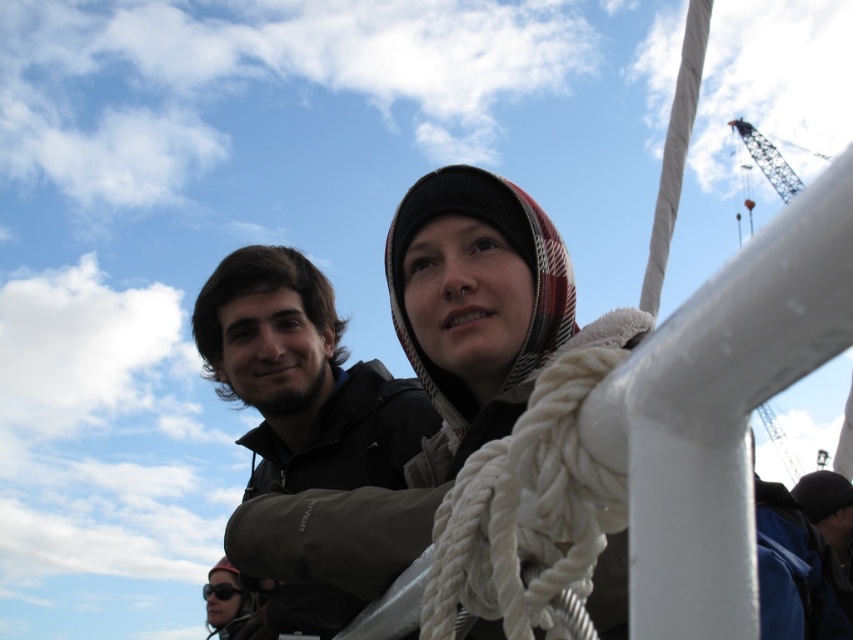
You are a photographer trying to capture a photo of the plaid woolen hat at upper center and the dark brown hair at center. Which object should you focus on first if you want to ensure both are in sharp focus?

The plaid woolen hat at upper center is shorter than the dark brown hair at center, so focusing on the dark brown hair at center first would ensure both are in sharp focus because it is farther away and has a greater depth of field.

You are a photographer trying to capture a clear shot of the dark brown hair at center and the plaid woolen hat at upper center. Which object should you focus on first to ensure both are in focus?

You should focus on the plaid woolen hat at upper center first because it is closer to the viewer than the dark brown hair at center. By focusing on the closer object, the farther one may still be within the depth of field.

You are a photographer trying to position a camera exactly at the center of the image. You need to ensure that the plaid woolen hat at upper center is within the frame. Given the coordinates provided, will the hat be visible in the center of the photo?

The plaid woolen hat at upper center is located at point (718, 410), which means it is positioned towards the upper right quadrant of the image. Since the center of the image is at (426, 320), the hat will not be centered but will still be visible in the upper right area of the photo.